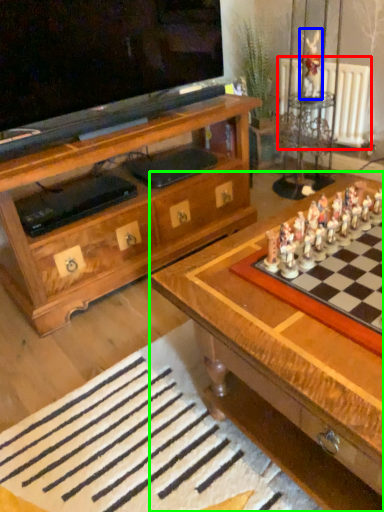
Question: Which object is positioned closest to radiator (highlighted by a red box)? Select from toy (highlighted by a blue box) and table (highlighted by a green box).

Choices:
 (A) toy
 (B) table

Answer: (A)